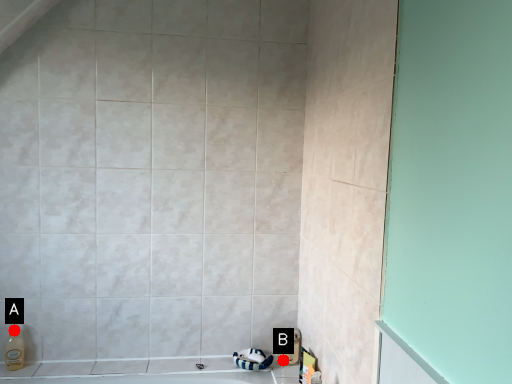
Question: Two points are circled on the image, labeled by A and B beside each circle. Which point is closer to the camera?

Choices:
 (A) A is closer
 (B) B is closer

Answer: (A)